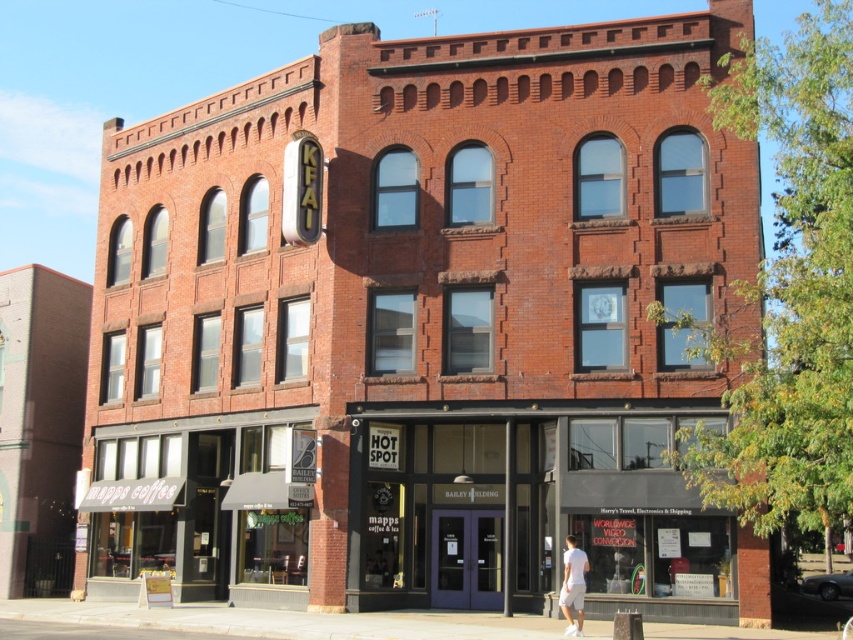
Question: Can you confirm if matte black storefront at center is smaller than white cotton shorts at lower right?

Choices:
 (A) no
 (B) yes

Answer: (A)

Question: Which point is farther to the camera?

Choices:
 (A) white cotton shorts at lower right
 (B) matte black storefront at center

Answer: (B)

Question: Does matte black storefront at center appear over white cotton shorts at lower right?

Choices:
 (A) yes
 (B) no

Answer: (A)

Question: Does matte black storefront at center have a smaller size compared to white cotton shorts at lower right?

Choices:
 (A) yes
 (B) no

Answer: (B)